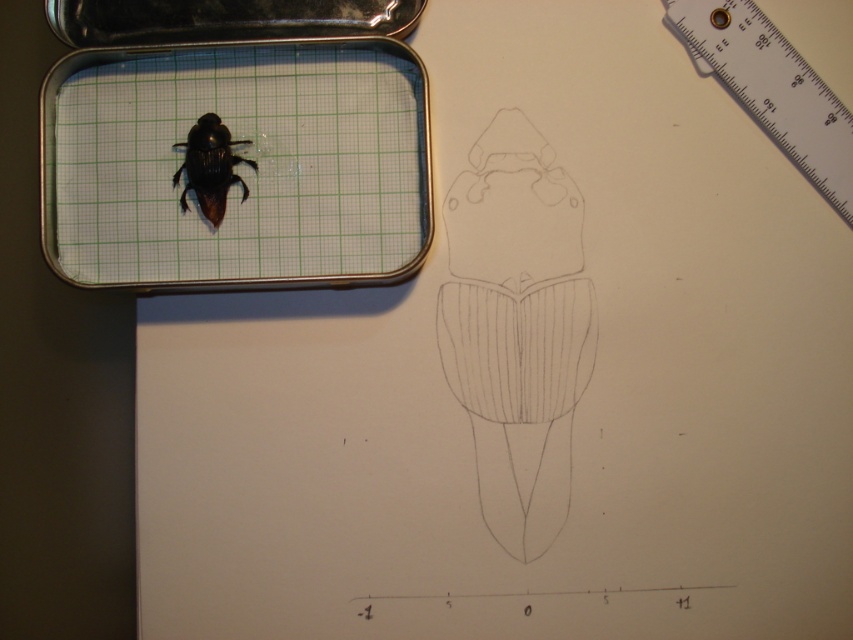
Question: Can you confirm if white plastic ruler at upper right is wider than shiny black beetle at center?

Choices:
 (A) yes
 (B) no

Answer: (A)

Question: Does white plastic ruler at upper right lie behind shiny black beetle at center?

Choices:
 (A) yes
 (B) no

Answer: (B)

Question: Can you confirm if white plastic ruler at upper right is wider than shiny black beetle at center?

Choices:
 (A) no
 (B) yes

Answer: (B)

Question: Which of the following is the farthest from the observer?

Choices:
 (A) shiny black beetle at center
 (B) white plastic ruler at upper right

Answer: (A)

Question: Which of the following is the closest to the observer?

Choices:
 (A) white plastic ruler at upper right
 (B) shiny black beetle at center

Answer: (A)